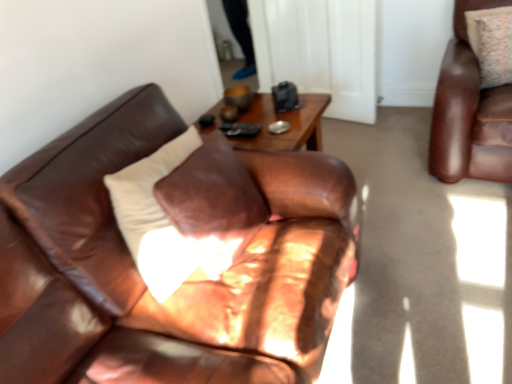
Question: Considering the positions of patterned fabric pillow at upper right and matte brown leather couch at center in the image, is patterned fabric pillow at upper right wider or thinner than matte brown leather couch at center?

Choices:
 (A) thin
 (B) wide

Answer: (A)

Question: From their relative heights in the image, would you say patterned fabric pillow at upper right is taller or shorter than matte brown leather couch at center?

Choices:
 (A) short
 (B) tall

Answer: (B)

Question: Which of these objects is positioned farthest from the transparent glass door at upper center?

Choices:
 (A) matte brown leather couch at center
 (B) patterned fabric pillow at upper right

Answer: (A)

Question: Which is farther from the patterned fabric pillow at upper right?

Choices:
 (A) transparent glass door at upper center
 (B) matte brown leather couch at center

Answer: (B)